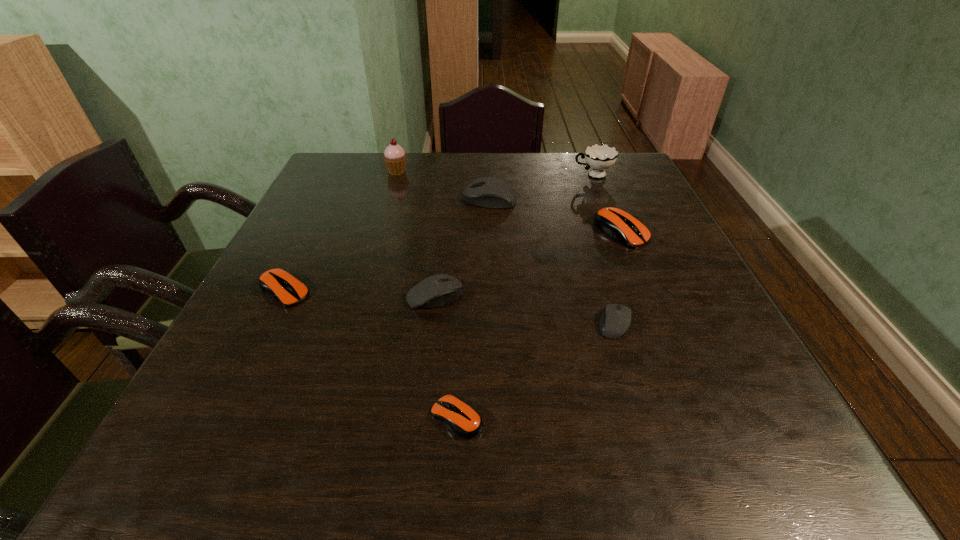
In order to click on computer mouse at the right edge in this screenshot , I will do `click(615, 222)`.

Locate an element on the screen. The image size is (960, 540). object that is at the far right corner is located at coordinates (599, 157).

At what (x,y) coordinates should I click in order to perform the action: click on vacant space at the far edge of the desktop. Please return your answer as a coordinate pair (x, y). This screenshot has height=540, width=960. Looking at the image, I should click on (523, 153).

At what (x,y) coordinates should I click in order to perform the action: click on vacant space at the near edge of the desktop. Please return your answer as a coordinate pair (x, y). This screenshot has height=540, width=960. Looking at the image, I should click on (519, 460).

In the image, there is a desktop. Where is `vacant space at the left edge`? Image resolution: width=960 pixels, height=540 pixels. vacant space at the left edge is located at coordinates (272, 253).

Locate an element on the screen. The width and height of the screenshot is (960, 540). vacant space at the right edge is located at coordinates (687, 390).

In the image, there is a desktop. Where is `vacant space at the far left corner`? This screenshot has width=960, height=540. vacant space at the far left corner is located at coordinates (342, 190).

This screenshot has width=960, height=540. I want to click on vacant space in between the farthest computer mouse and the rightmost black computer equipment, so click(552, 261).

Find the location of a particular element. vacant space that's between the second smallest orange computer mouse and the white cup is located at coordinates (439, 233).

At what (x,y) coordinates should I click in order to perform the action: click on empty location between the second biggest black computer equipment and the rightmost black computer equipment. Please return your answer as a coordinate pair (x, y). The width and height of the screenshot is (960, 540). Looking at the image, I should click on pos(525,309).